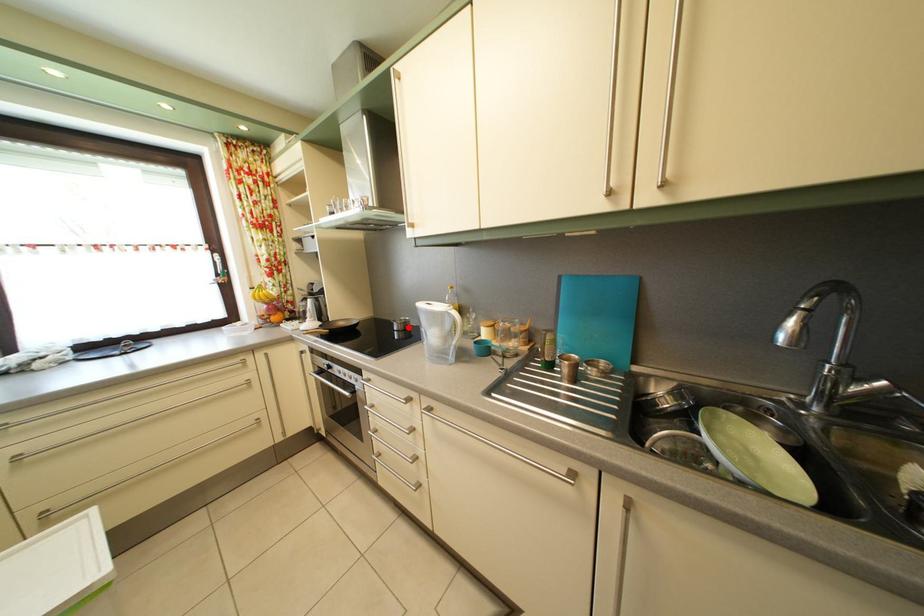
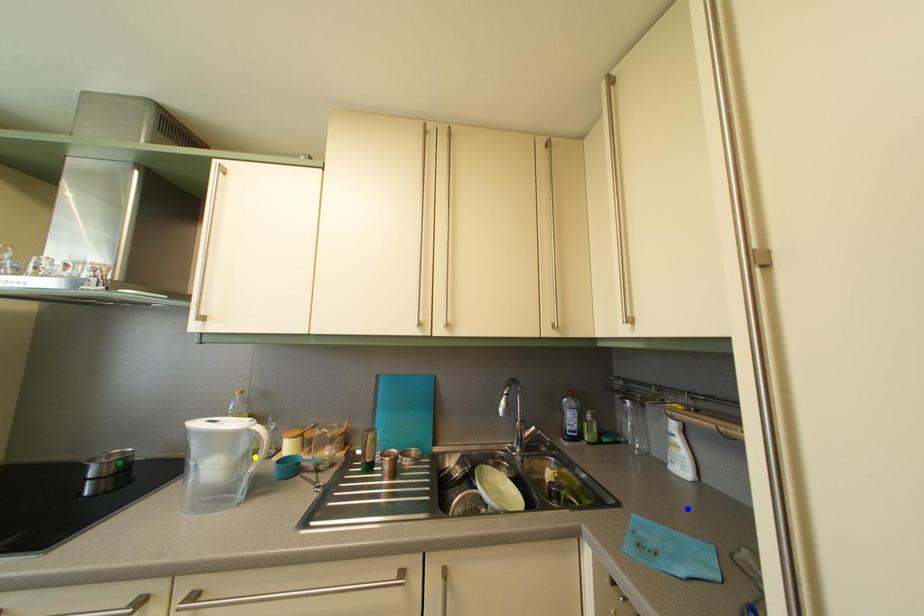
Question: I am providing you with two images of the same scene from different viewpoints. A red point is marked on the first image. You are given multiple points on the second image. Which spot in image 2 lines up with the point in image 1?

Choices:
 (A) green point
 (B) blue point
 (C) yellow point

Answer: (A)